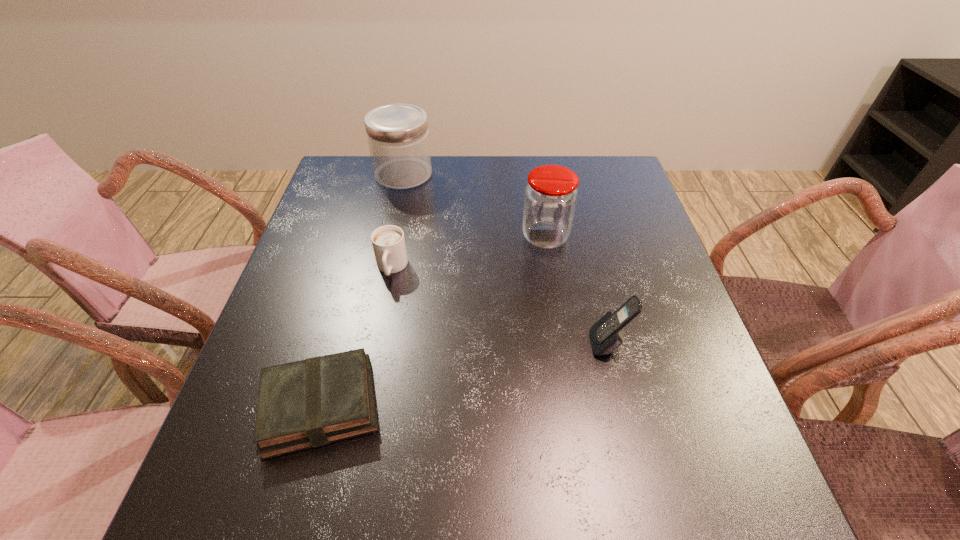
The width and height of the screenshot is (960, 540). I want to click on vacant space at the far edge, so click(481, 199).

At what (x,y) coordinates should I click in order to perform the action: click on vacant space at the near edge of the desktop. Please return your answer as a coordinate pair (x, y). Looking at the image, I should click on (573, 523).

At what (x,y) coordinates should I click in order to perform the action: click on free space at the left edge of the desktop. Please return your answer as a coordinate pair (x, y). This screenshot has height=540, width=960. Looking at the image, I should click on (300, 358).

You are a GUI agent. You are given a task and a screenshot of the screen. Output one action in this format:
    pyautogui.click(x=<x>, y=<y>)
    Task: Click on the blank space at the right edge of the desktop
    
    Given the screenshot: What is the action you would take?
    pyautogui.click(x=620, y=238)

In the image, there is a desktop. Where is `free space at the far left corner`? The height and width of the screenshot is (540, 960). free space at the far left corner is located at coordinates (363, 197).

This screenshot has width=960, height=540. In the image, there is a desktop. Find the location of `blank space at the near right corner`. blank space at the near right corner is located at coordinates (685, 474).

Image resolution: width=960 pixels, height=540 pixels. What are the coordinates of `vacant space that's between the cappuccino and the second nearest object` in the screenshot? It's located at (500, 306).

You are a GUI agent. You are given a task and a screenshot of the screen. Output one action in this format:
    pyautogui.click(x=<x>, y=<y>)
    Task: Click on the free point between the second shortest object and the farther jar
    
    Given the screenshot: What is the action you would take?
    pyautogui.click(x=397, y=221)

At what (x,y) coordinates should I click in order to perform the action: click on vacant space in between the cappuccino and the book. Please return your answer as a coordinate pair (x, y). Looking at the image, I should click on (356, 337).

Locate an element on the screen. free space between the book and the cellular telephone is located at coordinates (465, 375).